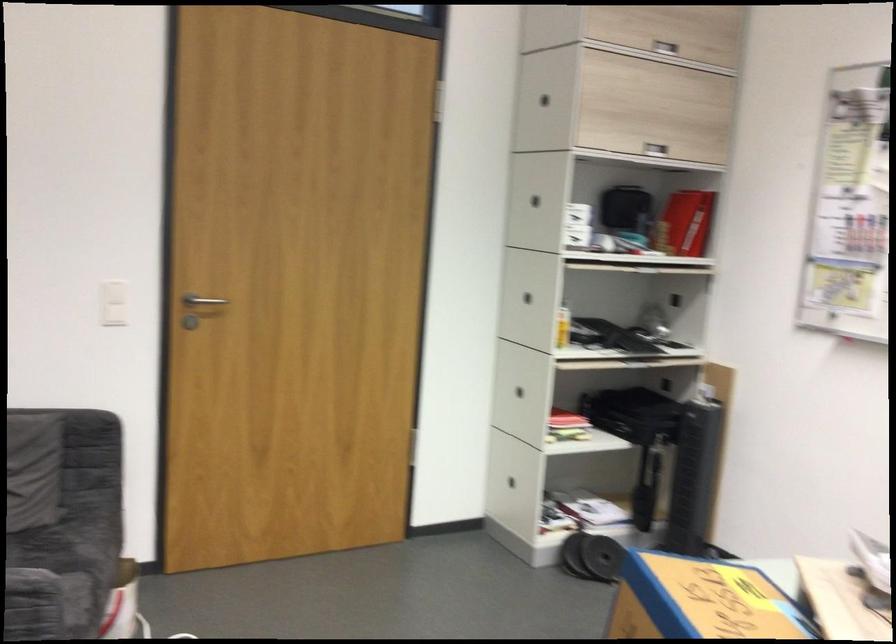
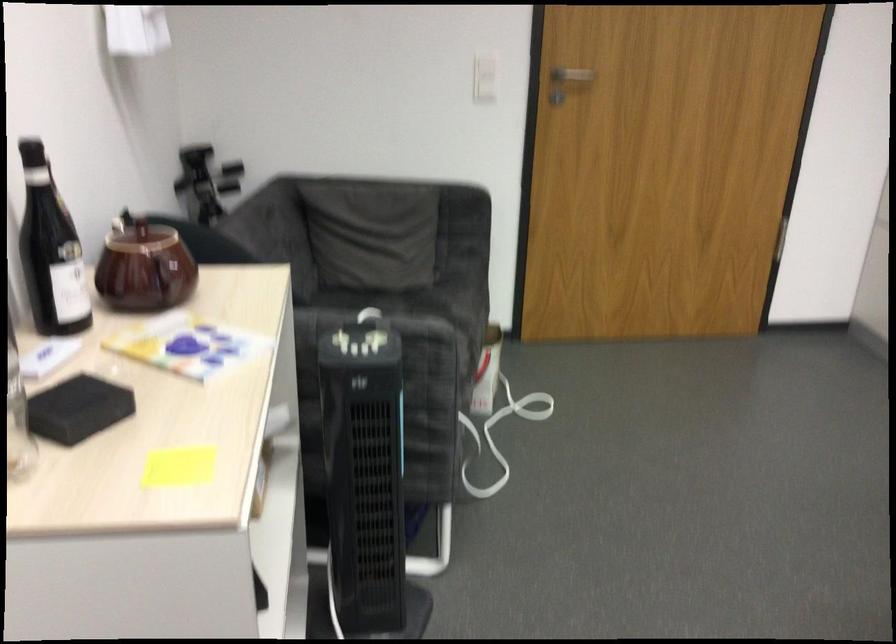
Where in the second image is the point corresponding to (x=109, y=310) from the first image?

(484, 77)